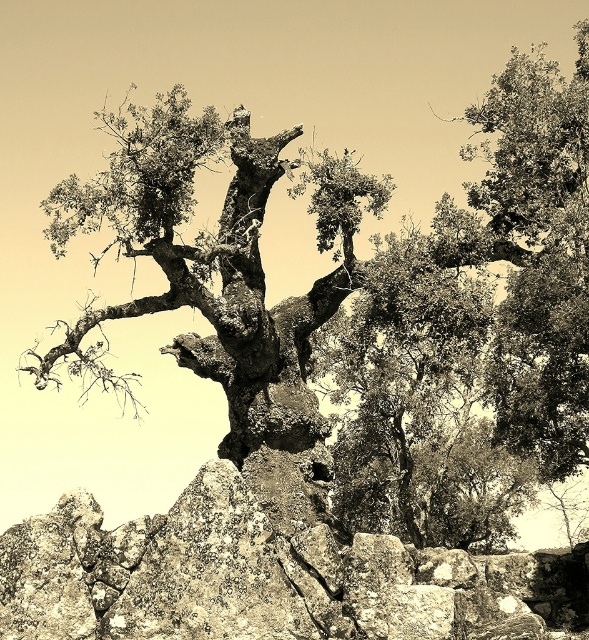
Which is behind, point (143, 547) or point (183, 92)?

The point (183, 92) is more distant.

Is rough textured rock at lower left smaller than rough bark tree trunk at center?

Indeed, rough textured rock at lower left has a smaller size compared to rough bark tree trunk at center.

Where is `rough textured rock at lower left`? rough textured rock at lower left is located at coordinates (266, 576).

Find the location of a particular element. rough textured rock at lower left is located at coordinates (266, 576).